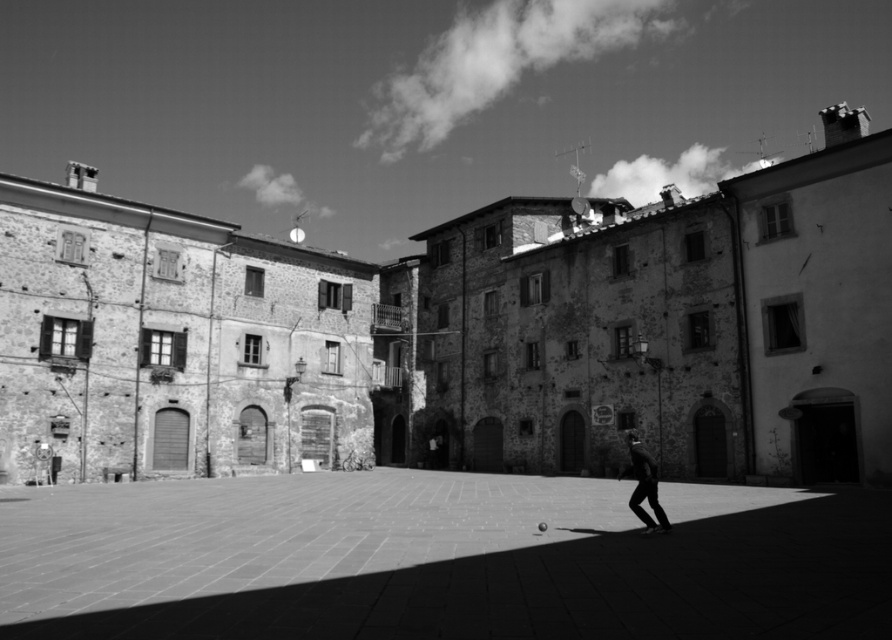
Which is more to the right, smooth stone alley at center or dark fabric pants at lower right?

Positioned to the right is dark fabric pants at lower right.

How distant is smooth stone alley at center from dark fabric pants at lower right?

A distance of 38.08 feet exists between smooth stone alley at center and dark fabric pants at lower right.

Which is in front, point (675, 486) or point (646, 486)?

Point (646, 486) is in front.

Where is `smooth stone alley at center`? This screenshot has height=640, width=892. smooth stone alley at center is located at coordinates pyautogui.click(x=439, y=560).